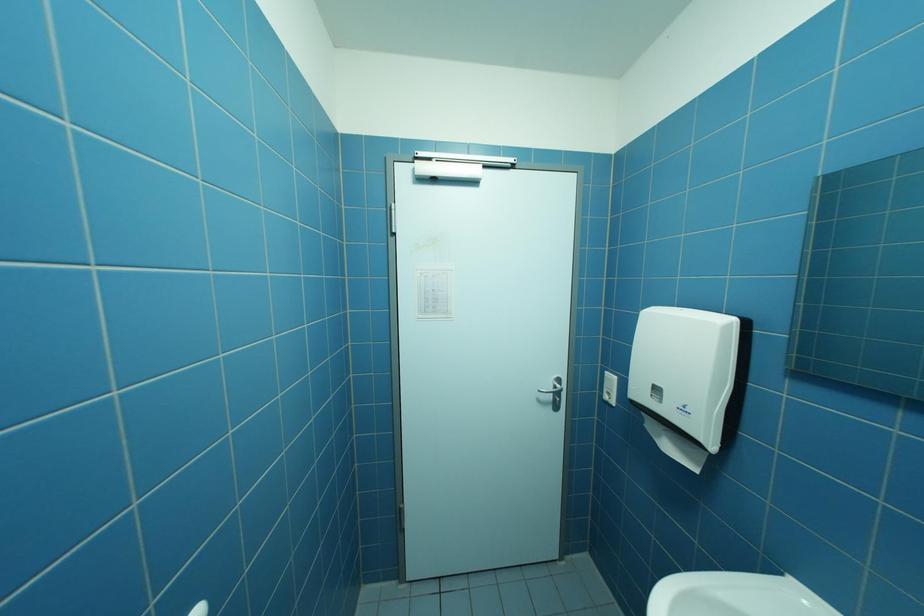
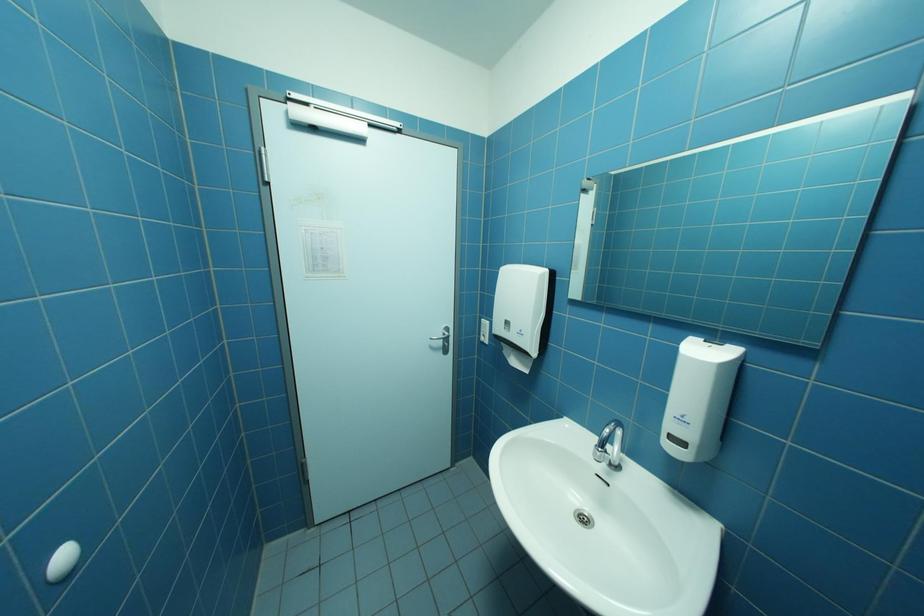
Question: What movement of the cameraman would produce the second image?

Choices:
 (A) Left
 (B) Right
 (C) Forward
 (D) Backward

Answer: (D)